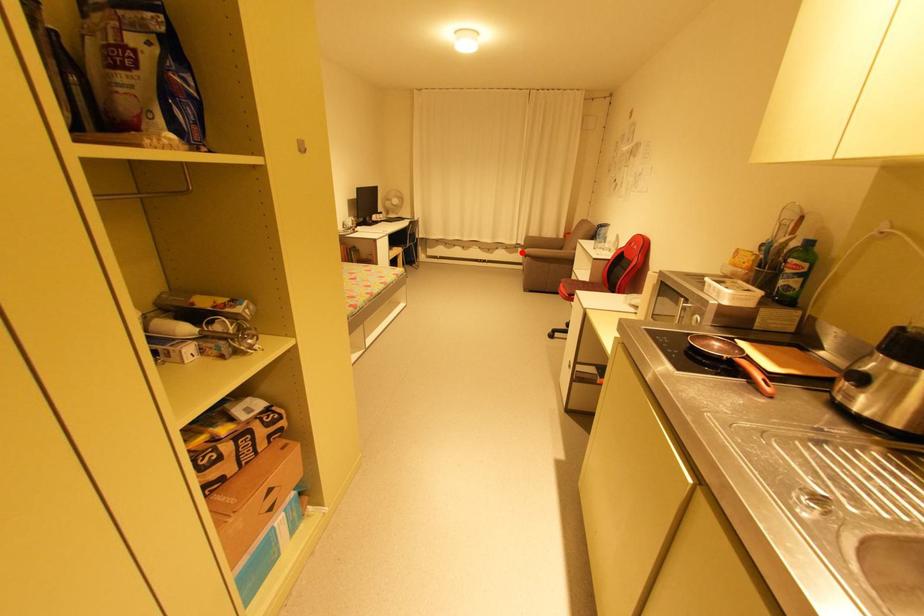
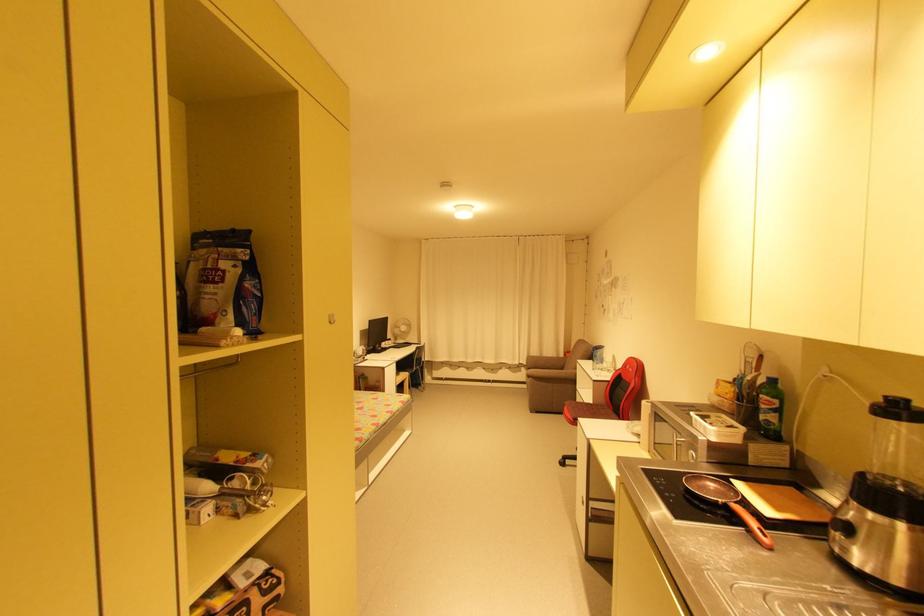
The point at the highlighted location is marked in the first image. Where is the corresponding point in the second image?

(525, 371)